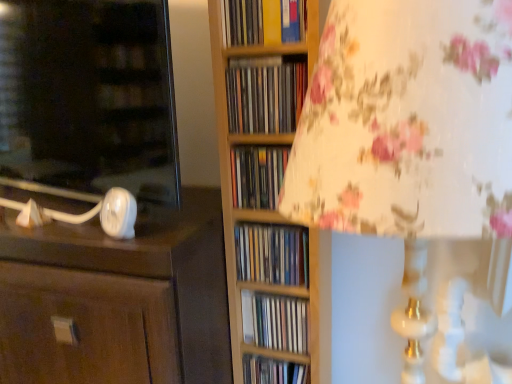
Question: Considering the relative sizes of matte plastic books at center, which appears as the 4th book when viewed from the top, and matte plastic books at center, placed as the 3th book when sorted from top to bottom, in the image provided, is matte plastic books at center, which appears as the 4th book when viewed from the top, wider than matte plastic books at center, placed as the 3th book when sorted from top to bottom,?

Choices:
 (A) no
 (B) yes

Answer: (B)

Question: Is matte plastic books at center, which appears as the 4th book when viewed from the top, not close to matte plastic books at center, placed as the 3th book when sorted from top to bottom?

Choices:
 (A) yes
 (B) no

Answer: (B)

Question: From a real-world perspective, is matte plastic books at center, which appears as the 4th book when viewed from the top, positioned under matte plastic books at center, placed as the 3th book when sorted from top to bottom, based on gravity?

Choices:
 (A) yes
 (B) no

Answer: (A)

Question: Does matte plastic books at center, which appears as the 3th book when ordered from the bottom, have a smaller size compared to matte plastic books at center, placed as the 3th book when sorted from top to bottom?

Choices:
 (A) no
 (B) yes

Answer: (A)

Question: From the image's perspective, would you say matte plastic books at center, which appears as the 4th book when viewed from the top, is shown under matte plastic books at center, the 4th book from the bottom?

Choices:
 (A) yes
 (B) no

Answer: (A)

Question: Can you confirm if matte plastic books at center, which appears as the 3th book when ordered from the bottom, is bigger than matte plastic books at center, the 4th book from the bottom?

Choices:
 (A) no
 (B) yes

Answer: (B)

Question: From a real-world perspective, is yellow paperback book at upper center, positioned as the first book in top-to-bottom order, below wooden cd case at center, the fifth book in the bottom-to-top sequence?

Choices:
 (A) yes
 (B) no

Answer: (B)

Question: Is yellow paperback book at upper center, positioned as the first book in top-to-bottom order, at the left side of wooden cd case at center, the fifth book in the bottom-to-top sequence?

Choices:
 (A) no
 (B) yes

Answer: (B)

Question: Is yellow paperback book at upper center, positioned as the first book in top-to-bottom order, positioned beyond the bounds of wooden cd case at center, the fifth book in the bottom-to-top sequence?

Choices:
 (A) no
 (B) yes

Answer: (B)

Question: Is yellow paperback book at upper center, acting as the sixth book starting from the bottom, thinner than wooden cd case at center, arranged as the second book when viewed from the top?

Choices:
 (A) yes
 (B) no

Answer: (B)

Question: From a real-world perspective, is yellow paperback book at upper center, positioned as the first book in top-to-bottom order, physically above wooden cd case at center, arranged as the second book when viewed from the top?

Choices:
 (A) yes
 (B) no

Answer: (A)

Question: Is yellow paperback book at upper center, acting as the sixth book starting from the bottom, directly adjacent to wooden cd case at center, arranged as the second book when viewed from the top?

Choices:
 (A) no
 (B) yes

Answer: (B)

Question: Does yellow paperback book at upper center, positioned as the first book in top-to-bottom order, have a lesser width compared to matte plastic books at center, the 1th book from the bottom?

Choices:
 (A) yes
 (B) no

Answer: (B)